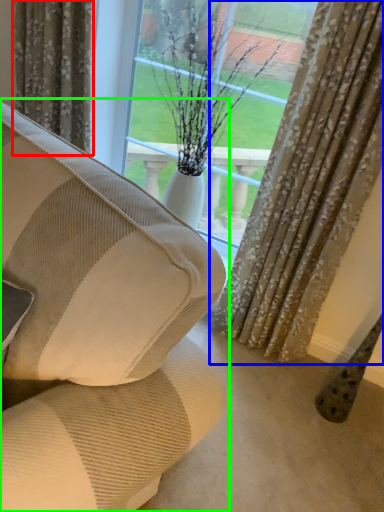
Question: Which object is the farthest from curtain (highlighted by a red box)? Choose among these: curtain (highlighted by a blue box) or studio couch (highlighted by a green box).

Choices:
 (A) curtain
 (B) studio couch

Answer: (B)